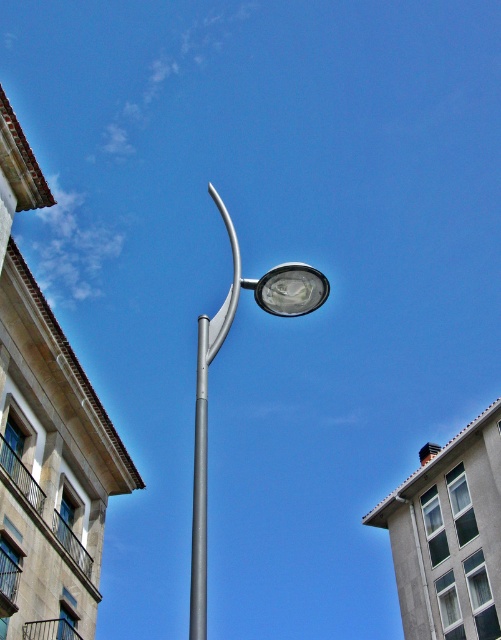
Question: Can you confirm if metallic pole at center is thinner than silver metallic pole at center?

Choices:
 (A) no
 (B) yes

Answer: (A)

Question: Does metallic pole at center have a smaller size compared to silver metallic pole at center?

Choices:
 (A) no
 (B) yes

Answer: (A)

Question: Does metallic pole at center appear over silver metallic pole at center?

Choices:
 (A) yes
 (B) no

Answer: (A)

Question: Which point is closer to the camera taking this photo?

Choices:
 (A) (321, 296)
 (B) (198, 561)

Answer: (B)

Question: Which object appears farthest from the camera in this image?

Choices:
 (A) metallic pole at center
 (B) silver metallic pole at center

Answer: (A)